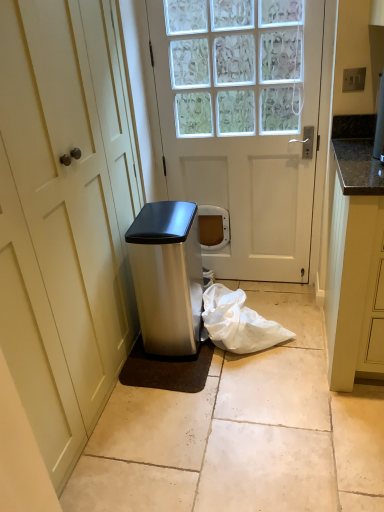
Question: Considering the positions of point (264, 273) and point (129, 322), is point (264, 273) closer or farther from the camera than point (129, 322)?

Choices:
 (A) closer
 (B) farther

Answer: (B)

Question: Choose the correct answer: Is white matte door at center, which is counted as the 1th door, starting from the right, inside white matte door at center, the 2th door from the right, or outside it?

Choices:
 (A) outside
 (B) inside

Answer: (A)

Question: Which of these objects is positioned farthest from the granite countertop at right?

Choices:
 (A) white matte plastic bag at lower center
 (B) white matte door at center, which is counted as the 1th door, starting from the right
 (C) white matte door at center, the 2th door from the right
 (D) satin silver trash can at lower left

Answer: (C)

Question: Estimate the real-world distances between objects in this image. Which object is closer to the satin silver trash can at lower left?

Choices:
 (A) granite countertop at right
 (B) white matte door at center, positioned as the second door in left-to-right order
 (C) white matte plastic bag at lower center
 (D) white matte door at center, the 1th door when ordered from left to right

Answer: (C)